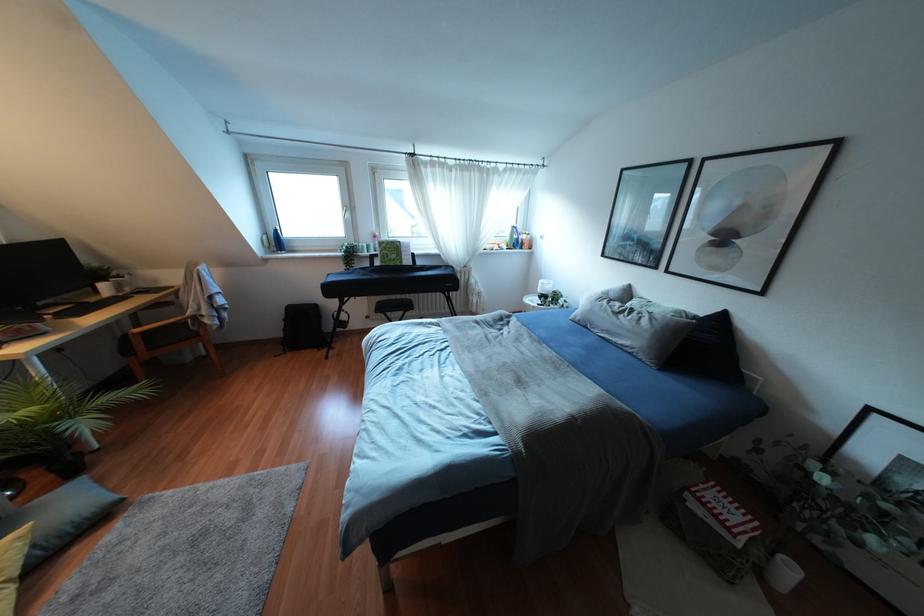
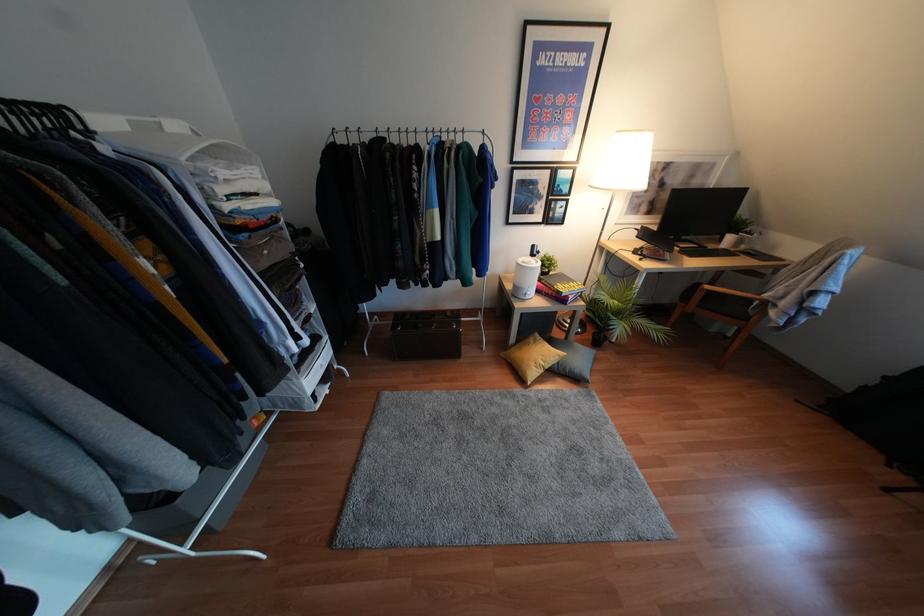
Where in the second image is the point corresponding to (78,453) from the first image?

(604, 336)